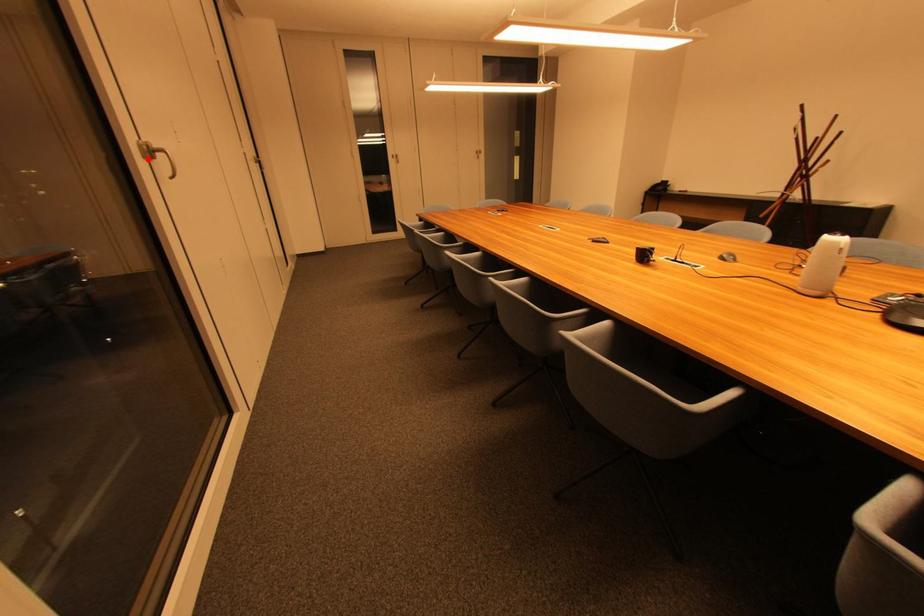
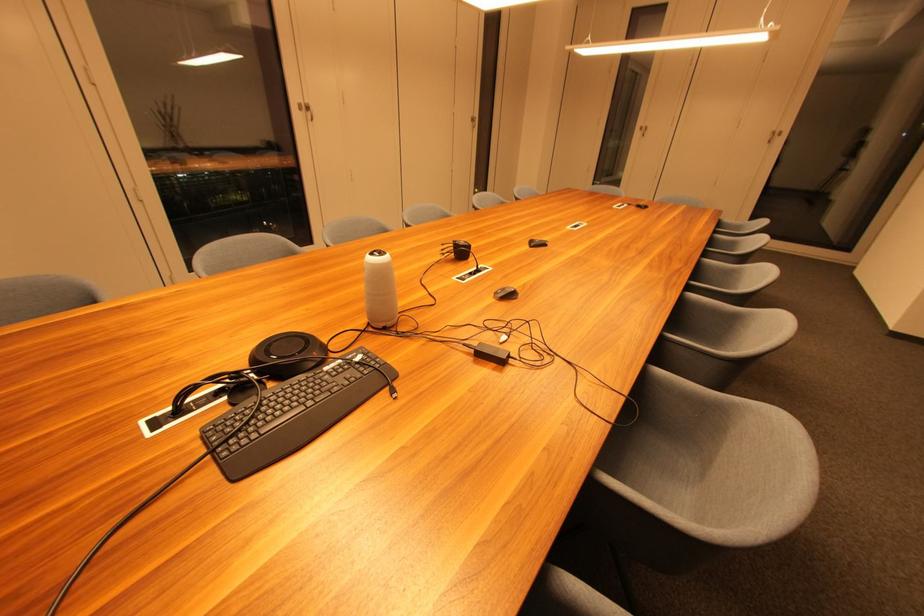
Where in the second image is the point corresponding to the highlighted location from the first image?

(306, 111)